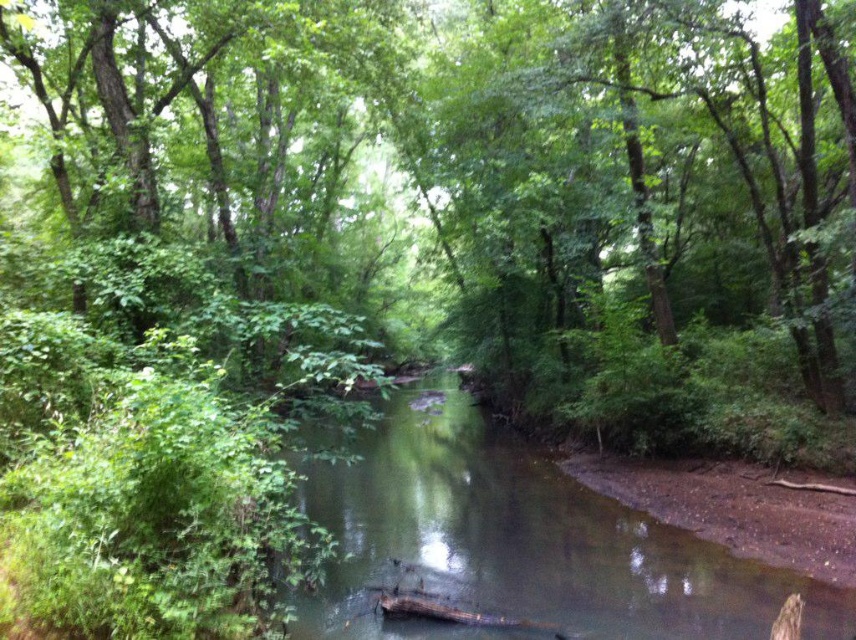
Between green leafy tree at center and clear water at center, which one has more height?

green leafy tree at center is taller.

Is green leafy tree at center closer to the viewer compared to clear water at center?

Yes, it is.

Locate an element on the screen. green leafy tree at center is located at coordinates (446, 166).